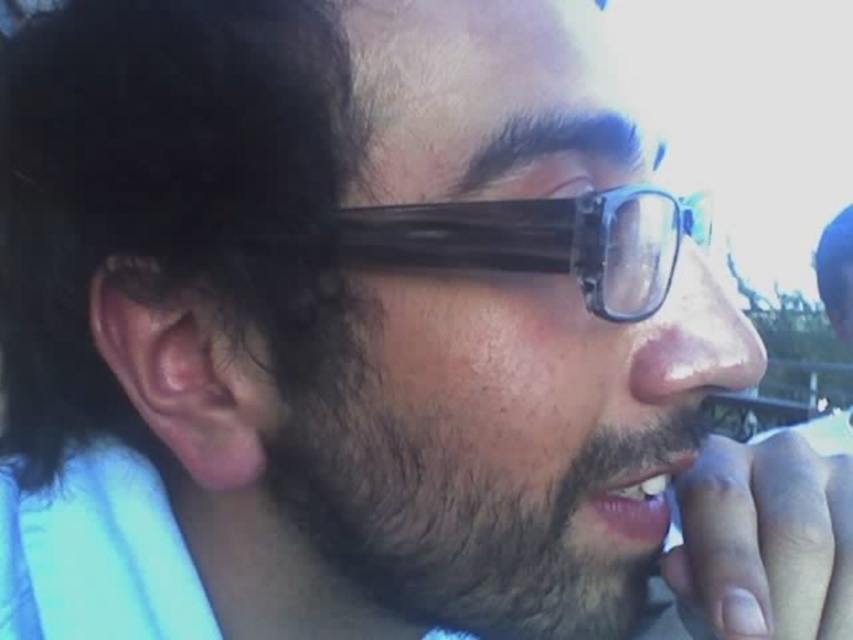
The width and height of the screenshot is (853, 640). Describe the element at coordinates (531, 241) in the screenshot. I see `black plastic glasses at center` at that location.

Can you confirm if black plastic glasses at center is shorter than pink flesh-colored ear at left?

Indeed, black plastic glasses at center has a lesser height compared to pink flesh-colored ear at left.

I want to click on black plastic glasses at center, so click(531, 241).

Is dark brown fuzzy beard at lower left above black plastic glasses at center?

No, dark brown fuzzy beard at lower left is not above black plastic glasses at center.

Does point (503, 570) come closer to viewer compared to point (634, 316)?

No.

You are a GUI agent. You are given a task and a screenshot of the screen. Output one action in this format:
    pyautogui.click(x=<x>, y=<y>)
    Task: Click on the dark brown fuzzy beard at lower left
    Image resolution: width=853 pixels, height=640 pixels.
    Given the screenshot: What is the action you would take?
    pyautogui.click(x=473, y=483)

Does dark brown fuzzy beard at lower left appear on the right side of pink flesh-colored ear at left?

Correct, you'll find dark brown fuzzy beard at lower left to the right of pink flesh-colored ear at left.

Who is more forward, (x=582, y=496) or (x=169, y=316)?

Point (x=582, y=496)

Does point (422, 387) come closer to viewer compared to point (102, 317)?

Yes, it is in front of point (102, 317).

Identify the location of dark brown fuzzy beard at lower left. (473, 483).